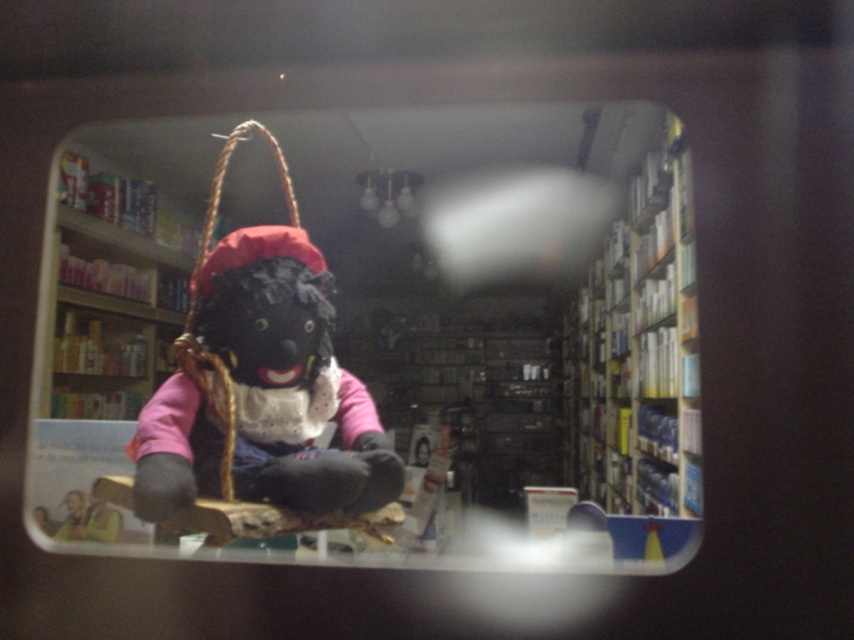
Question: Which of the following is the closest to the observer?

Choices:
 (A) matte black doll at center
 (B) white cardboard bookshelf at right

Answer: (A)

Question: Is matte black doll at center bigger than white cardboard bookshelf at right?

Choices:
 (A) no
 (B) yes

Answer: (A)

Question: Is velvet plush doll at center to the left of matte black doll at center from the viewer's perspective?

Choices:
 (A) yes
 (B) no

Answer: (B)

Question: Which point is farther to the camera?

Choices:
 (A) velvet plush doll at center
 (B) matte black doll at center

Answer: (A)

Question: Based on their relative distances, which object is nearer to the matte black doll at center?

Choices:
 (A) white cardboard bookshelf at right
 (B) velvet plush doll at center

Answer: (A)

Question: Can you confirm if velvet plush doll at center is thinner than matte black doll at center?

Choices:
 (A) yes
 (B) no

Answer: (A)